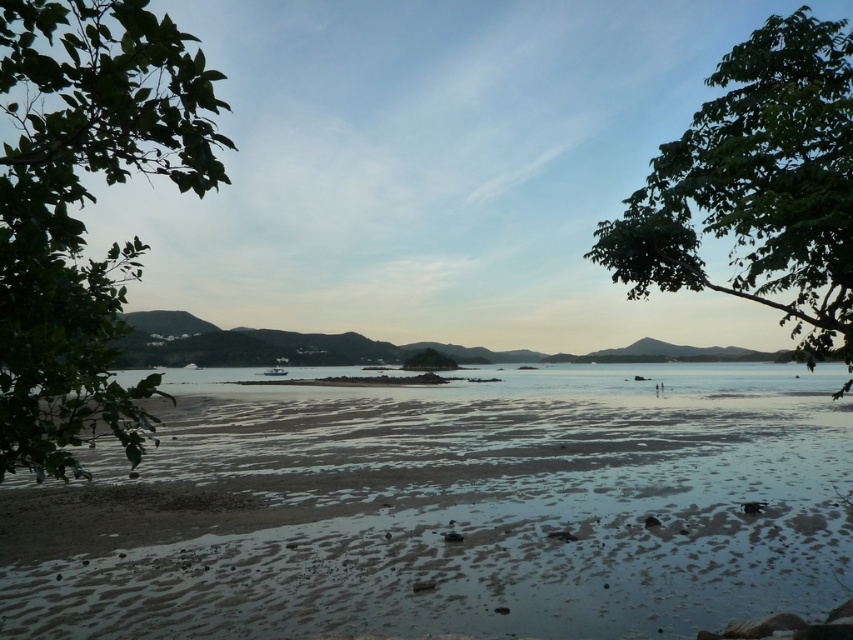
Can you confirm if green leafy tree at left is taller than green leafy tree at upper right?

Yes.

Describe the element at coordinates (80, 204) in the screenshot. The image size is (853, 640). I see `green leafy tree at left` at that location.

Is point (91, 48) in front of point (749, 108)?

Yes, it is.

Find the location of `green leafy tree at left`. green leafy tree at left is located at coordinates (80, 204).

Which is above, sandy beach at lower left or green leafy tree at upper right?

Positioned higher is green leafy tree at upper right.

Who is positioned more to the right, sandy beach at lower left or green leafy tree at upper right?

Positioned to the right is green leafy tree at upper right.

From the picture: Who is more forward, (712, 605) or (598, 230)?

Point (598, 230)

The width and height of the screenshot is (853, 640). Find the location of `sandy beach at lower left`. sandy beach at lower left is located at coordinates (480, 508).

Can you confirm if sandy beach at lower left is positioned to the right of green leafy tree at left?

Correct, you'll find sandy beach at lower left to the right of green leafy tree at left.

Is sandy beach at lower left bigger than green leafy tree at left?

Yes.

Where is `sandy beach at lower left`? sandy beach at lower left is located at coordinates (480, 508).